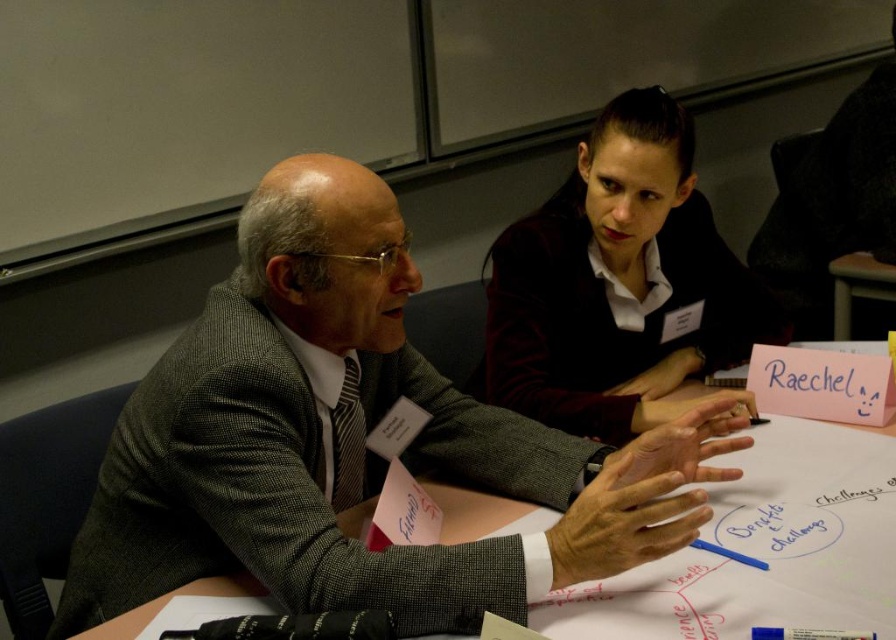
Question: Is gray wool suit at center to the right of maroon fabric shirt at upper right from the viewer's perspective?

Choices:
 (A) no
 (B) yes

Answer: (A)

Question: Observing the image, what is the correct spatial positioning of gray wool suit at center in reference to maroon fabric shirt at upper right?

Choices:
 (A) right
 (B) left

Answer: (B)

Question: Which point is farther from the camera taking this photo?

Choices:
 (A) (438, 433)
 (B) (634, 234)

Answer: (B)

Question: Which point is closer to the camera?

Choices:
 (A) (610, 429)
 (B) (395, 388)

Answer: (B)

Question: In this image, where is gray wool suit at center located relative to maroon fabric shirt at upper right?

Choices:
 (A) above
 (B) below

Answer: (B)

Question: Which point appears closest to the camera in this image?

Choices:
 (A) (669, 132)
 (B) (99, 611)

Answer: (B)